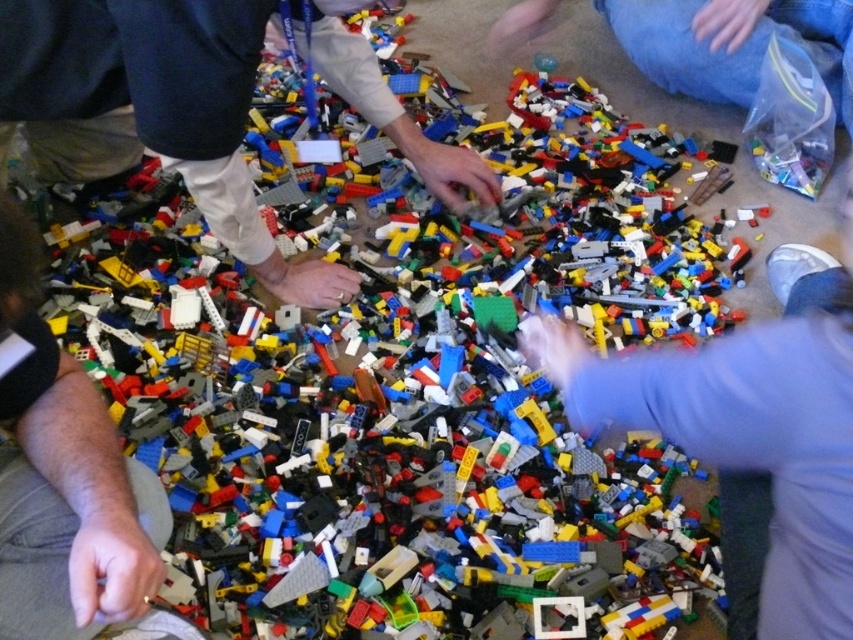
You are trying to pick up the LEGO bricks from the floor. There is a dark gray fabric hand at lower left and a matte white pants at center in your way. Which object is closer to you?

The dark gray fabric hand at lower left is behind the matte white pants at center, so the matte white pants at center is closer to you.

Looking at the LEGO bricks scene, there are two hands interacting with the pieces. One is a smooth plastic hand at center and the other is a dark gray fabric hand at lower left. Which hand is positioned more to the right side of the image?

The smooth plastic hand at center is positioned more to the right side of the image compared to the dark gray fabric hand at lower left.